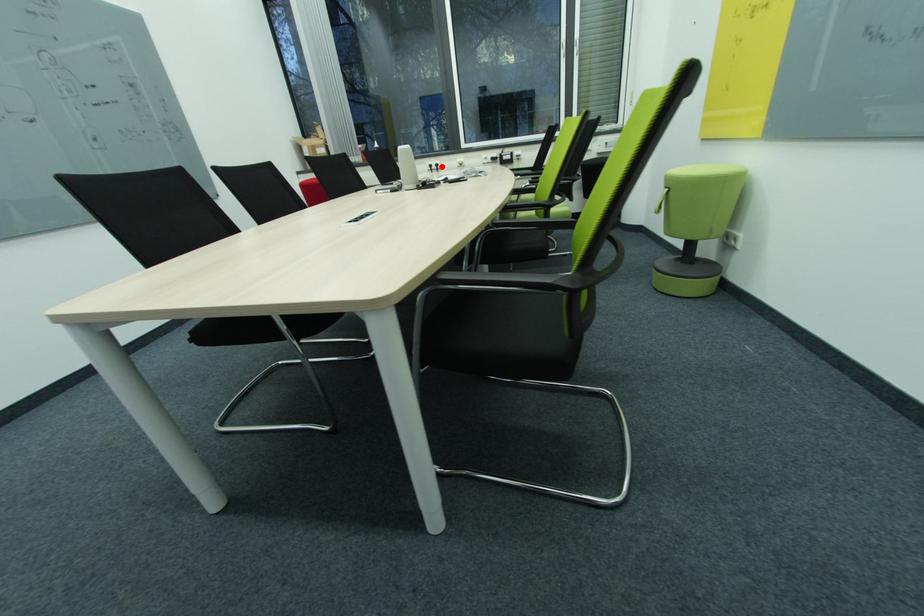
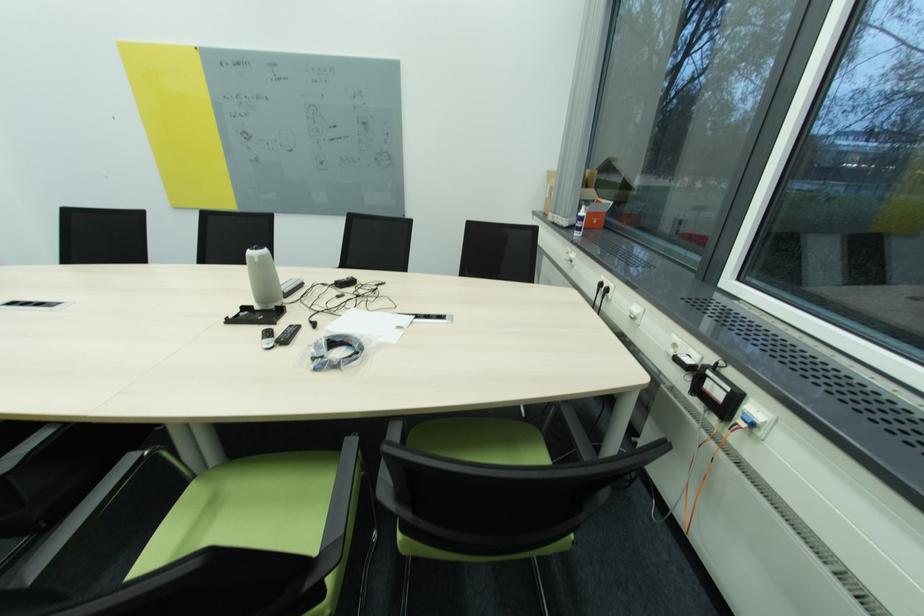
Question: I am providing you with two images of the same scene from different viewpoints. A red point is marked on the first image. Is the red point's position out of view in image 2?

Choices:
 (A) Yes
 (B) No

Answer: (B)